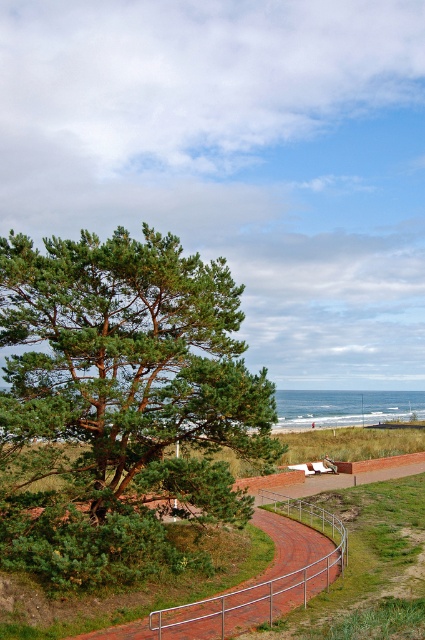
Question: Can you confirm if green needle-like at center is smaller than brick paved path at lower center?

Choices:
 (A) no
 (B) yes

Answer: (A)

Question: Is green needle-like at center smaller than brick paved path at lower center?

Choices:
 (A) no
 (B) yes

Answer: (A)

Question: Can you confirm if green needle-like at center is wider than brick paved path at lower center?

Choices:
 (A) yes
 (B) no

Answer: (A)

Question: Which point is closer to the camera?

Choices:
 (A) brick paved path at lower center
 (B) green needle-like at center

Answer: (A)

Question: Which object appears farthest from the camera in this image?

Choices:
 (A) brick paved path at lower center
 (B) green needle-like at center

Answer: (B)

Question: Which of the following is the closest to the observer?

Choices:
 (A) (53, 433)
 (B) (275, 566)

Answer: (A)